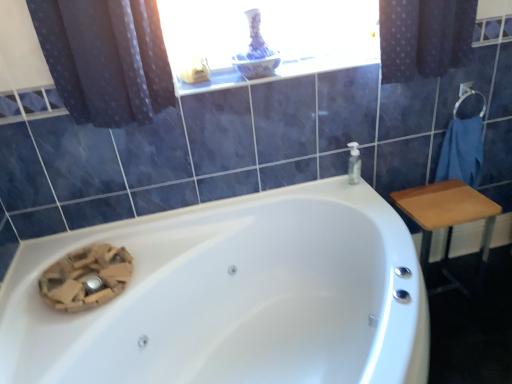
Describe the element at coordinates (277, 72) in the screenshot. I see `white glossy window sill at upper center` at that location.

Describe the element at coordinates (354, 164) in the screenshot. I see `transparent plastic soap dispenser at upper right` at that location.

What do you see at coordinates (462, 152) in the screenshot? This screenshot has height=384, width=512. I see `blue cotton towel at right` at bounding box center [462, 152].

Identify the location of white glossy bathtub at center. (233, 297).

At what (x,y) coordinates should I click in order to perform the action: click on white glossy window sill at upper center. Please return your answer as a coordinate pair (x, y). The width and height of the screenshot is (512, 384). Looking at the image, I should click on (277, 72).

Is white glossy bathtub at center aimed at wooden table at right?

No, white glossy bathtub at center is not turned towards wooden table at right.

Where is `bathtub located in front of the wooden table at right`? Image resolution: width=512 pixels, height=384 pixels. bathtub located in front of the wooden table at right is located at coordinates (233, 297).

Considering the positions of objects white glossy bathtub at center and wooden table at right in the image provided, who is in front, white glossy bathtub at center or wooden table at right?

white glossy bathtub at center.

Would you say transparent plastic soap dispenser at upper right is inside or outside white glossy bathtub at center?

transparent plastic soap dispenser at upper right is spatially situated outside white glossy bathtub at center.

From a real-world perspective, is transparent plastic soap dispenser at upper right over white glossy bathtub at center?

Yes, from a real-world perspective, transparent plastic soap dispenser at upper right is over white glossy bathtub at center

The height and width of the screenshot is (384, 512). What are the coordinates of `bathtub located underneath the transparent plastic soap dispenser at upper right (from a real-world perspective)` in the screenshot? It's located at (233, 297).

From the image's perspective, is transparent plastic soap dispenser at upper right positioned above or below white glossy bathtub at center?

From the image's perspective, transparent plastic soap dispenser at upper right appears above white glossy bathtub at center.

Does white glossy window sill at upper center turn towards transparent plastic soap dispenser at upper right?

No, white glossy window sill at upper center does not turn towards transparent plastic soap dispenser at upper right.

Are white glossy window sill at upper center and transparent plastic soap dispenser at upper right located far from each other?

No, white glossy window sill at upper center is in close proximity to transparent plastic soap dispenser at upper right.

Would you say transparent plastic soap dispenser at upper right is part of white glossy window sill at upper center's contents?

No, white glossy window sill at upper center does not contain transparent plastic soap dispenser at upper right.

From a real-world perspective, does white glossy window sill at upper center stand above transparent plastic soap dispenser at upper right?

Indeed, from a real-world perspective, white glossy window sill at upper center stands above transparent plastic soap dispenser at upper right.

Is transparent plastic soap dispenser at upper right situated inside wooden table at right or outside?

transparent plastic soap dispenser at upper right is outside wooden table at right.

From the picture: From a real-world perspective, which object rests below the other?

In real-world perspective, wooden table at right is lower.

Looking at this image, are transparent plastic soap dispenser at upper right and wooden table at right making contact?

No, transparent plastic soap dispenser at upper right is not next to wooden table at right.

Can you tell me how much transparent plastic soap dispenser at upper right and wooden table at right differ in facing direction?

There is a 3.89-degree angle between the facing directions of transparent plastic soap dispenser at upper right and wooden table at right.

Is blue cotton towel at right placed right next to wooden table at right?

No, blue cotton towel at right is not with wooden table at right.

Is blue cotton towel at right closer to camera compared to wooden table at right?

That is False.

Does blue cotton towel at right have a larger size compared to wooden table at right?

Incorrect, blue cotton towel at right is not larger than wooden table at right.

From a real-world perspective, is blue cotton towel at right above or below wooden table at right?

In terms of real-world spatial position, blue cotton towel at right is above wooden table at right.

Considering the relative positions of transparent plastic soap dispenser at upper right and blue cotton towel at right in the image provided, is transparent plastic soap dispenser at upper right behind blue cotton towel at right?

No.

Is transparent plastic soap dispenser at upper right facing towards blue cotton towel at right?

No, transparent plastic soap dispenser at upper right is not turned towards blue cotton towel at right.

Considering the points (349, 166) and (467, 133), which point is in front, point (349, 166) or point (467, 133)?

Point (349, 166)

Can you tell me how much transparent plastic soap dispenser at upper right and blue cotton towel at right differ in facing direction?

There is a 0.000284-degree angle between the facing directions of transparent plastic soap dispenser at upper right and blue cotton towel at right.

Between white glossy bathtub at center and blue cotton towel at right, which one has more height?

white glossy bathtub at center.

Where is `bathtub in front of the blue cotton towel at right`? bathtub in front of the blue cotton towel at right is located at coordinates (233, 297).

Is white glossy bathtub at center in front of or behind blue cotton towel at right in the image?

Clearly, white glossy bathtub at center is in front of blue cotton towel at right.

From the image's perspective, is white glossy bathtub at center on blue cotton towel at right?

No, from the image's perspective, white glossy bathtub at center is not on top of blue cotton towel at right.

You are a GUI agent. You are given a task and a screenshot of the screen. Output one action in this format:
    pyautogui.click(x=<x>, y=<y>)
    Task: Click on the bathtub in front of the wooden table at right
    
    Given the screenshot: What is the action you would take?
    pyautogui.click(x=233, y=297)

Where is `soap dispenser above the white glossy bathtub at center (from a real-world perspective)`? This screenshot has width=512, height=384. soap dispenser above the white glossy bathtub at center (from a real-world perspective) is located at coordinates (354, 164).

From the picture: When comparing their distances from white glossy bathtub at center, does white glossy window sill at upper center or blue cotton towel at right seem further?

The object further to white glossy bathtub at center is blue cotton towel at right.

Looking at the image, which one is located closer to transparent plastic soap dispenser at upper right, white glossy window sill at upper center or blue cotton towel at right?

white glossy window sill at upper center lies closer to transparent plastic soap dispenser at upper right than the other object.

Which object lies further to the anchor point white glossy window sill at upper center, wooden table at right or transparent plastic soap dispenser at upper right?

The object further to white glossy window sill at upper center is wooden table at right.

Looking at the image, which one is located closer to wooden table at right, white glossy bathtub at center or transparent plastic soap dispenser at upper right?

transparent plastic soap dispenser at upper right lies closer to wooden table at right than the other object.

Considering their positions, is transparent plastic soap dispenser at upper right positioned further to blue cotton towel at right than wooden table at right?

Based on the image, transparent plastic soap dispenser at upper right appears to be further to blue cotton towel at right.

From the picture: From the image, which object appears to be farther from wooden table at right, blue cotton towel at right or transparent plastic soap dispenser at upper right?

The object further to wooden table at right is transparent plastic soap dispenser at upper right.

Considering their positions, is wooden table at right positioned further to blue cotton towel at right than white glossy bathtub at center?

white glossy bathtub at center lies further to blue cotton towel at right than the other object.

Estimate the real-world distances between objects in this image. Which object is further from blue cotton towel at right, wooden table at right or transparent plastic soap dispenser at upper right?

Answer: transparent plastic soap dispenser at upper right.

Where is `window sill between white glossy bathtub at center and blue cotton towel at right from left to right`? This screenshot has width=512, height=384. window sill between white glossy bathtub at center and blue cotton towel at right from left to right is located at coordinates pyautogui.click(x=277, y=72).

Identify the location of soap dispenser located between white glossy bathtub at center and blue cotton towel at right in the depth direction. (354, 164).

Find the location of `soap dispenser between white glossy window sill at upper center and white glossy bathtub at center in the up-down direction`. soap dispenser between white glossy window sill at upper center and white glossy bathtub at center in the up-down direction is located at coordinates (354, 164).

Where is `furniture between white glossy bathtub at center and transparent plastic soap dispenser at upper right along the z-axis`? This screenshot has height=384, width=512. furniture between white glossy bathtub at center and transparent plastic soap dispenser at upper right along the z-axis is located at coordinates (448, 222).